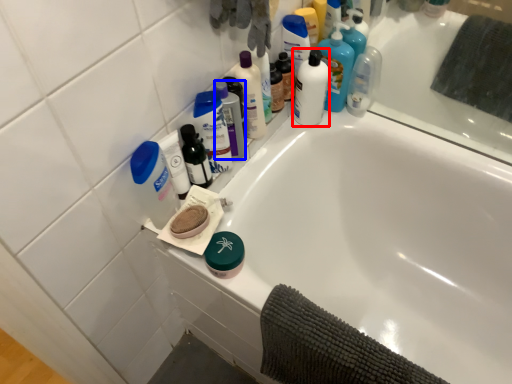
Question: Among these objects, which one is farthest to the camera, mouthwash (highlighted by a red box) or mouthwash (highlighted by a blue box)?

Choices:
 (A) mouthwash
 (B) mouthwash

Answer: (A)